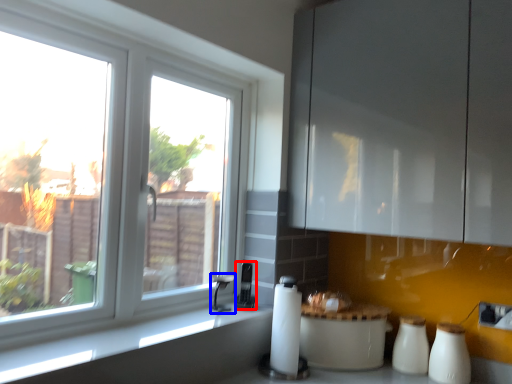
Question: Which object appears closest to the camera in this image, appliance (highlighted by a red box) or faucet (highlighted by a blue box)?

Choices:
 (A) appliance
 (B) faucet

Answer: (B)